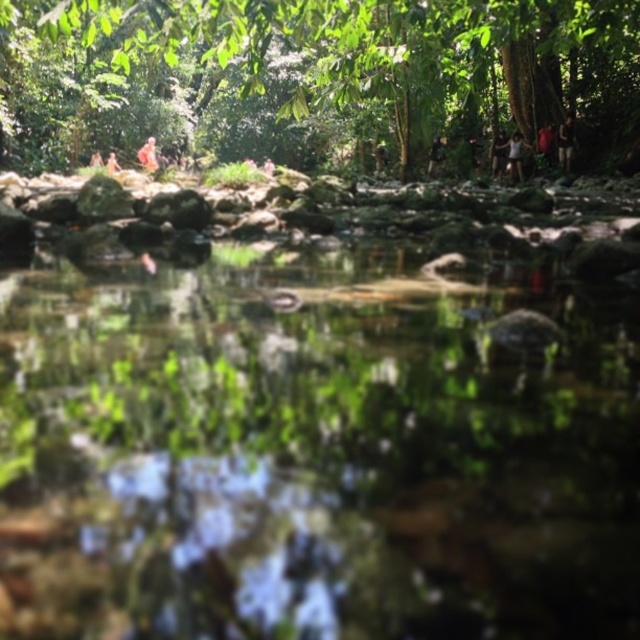
Question: Estimate the real-world distances between objects in this image. Which object is farther from the dark brown leather jacket at upper right?

Choices:
 (A) green leafy tree at upper center
 (B) dark brown leather jacket at upper center
 (C) clear water at center

Answer: (C)

Question: Can you confirm if green leafy tree at upper center is wider than dark brown leather jacket at upper right?

Choices:
 (A) no
 (B) yes

Answer: (B)

Question: Which point is farther from the camera taking this photo?

Choices:
 (A) pyautogui.click(x=522, y=154)
 (B) pyautogui.click(x=538, y=132)

Answer: (B)

Question: Which point is closer to the camera?

Choices:
 (A) clear water at center
 (B) white cotton shirt at upper right

Answer: (A)

Question: Is clear water at center further to the viewer compared to light brown wooden stick at upper right?

Choices:
 (A) yes
 (B) no

Answer: (B)

Question: Can you confirm if green leafy tree at upper center is thinner than dark brown leather jacket at upper center?

Choices:
 (A) yes
 (B) no

Answer: (B)